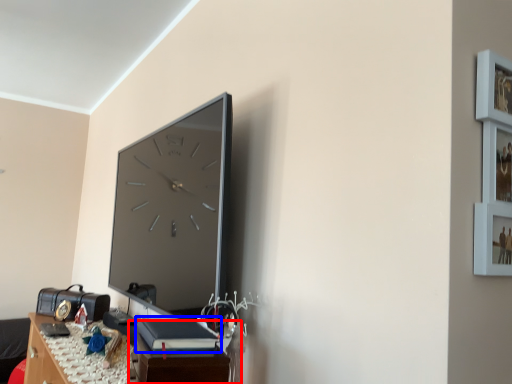
Question: Among these objects, which one is farthest to the camera, table (highlighted by a red box) or book (highlighted by a blue box)?

Choices:
 (A) table
 (B) book

Answer: (B)